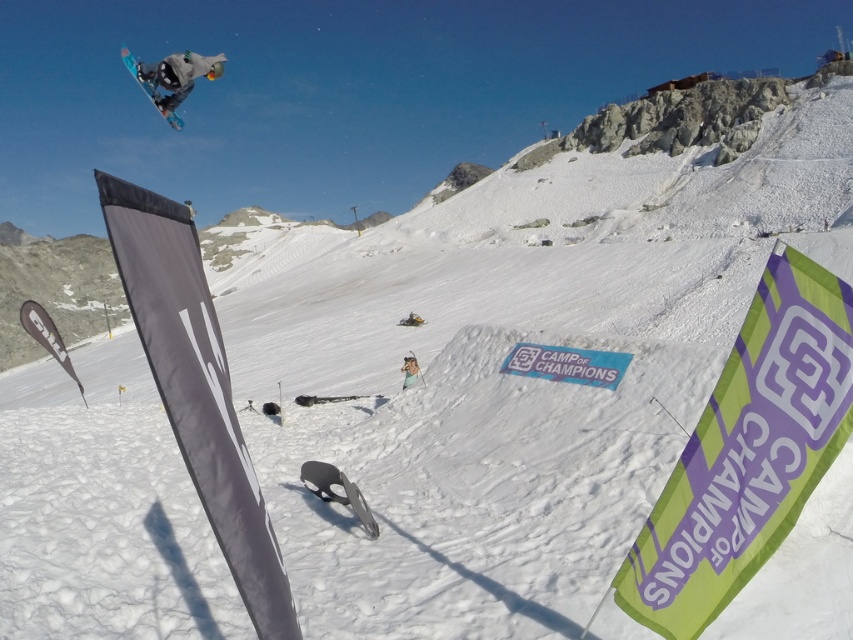
Question: Considering the real-world distances, which object is farthest from the gray matte snowboarder at upper left?

Choices:
 (A) white matte snowboarder at center
 (B) shiny blue snowboard at upper left

Answer: (B)

Question: Can you confirm if gray matte snowboarder at upper left is wider than white matte snowboarder at center?

Choices:
 (A) no
 (B) yes

Answer: (B)

Question: Is gray matte snowboarder at upper left above shiny blue snowboard at upper left?

Choices:
 (A) yes
 (B) no

Answer: (B)

Question: Which point is closer to the camera?

Choices:
 (A) shiny blue snowboard at upper left
 (B) gray matte snowboarder at upper left
 (C) white matte snowboarder at center

Answer: (C)

Question: Which object is farther from the camera taking this photo?

Choices:
 (A) shiny blue snowboard at upper left
 (B) white matte snowboarder at center
 (C) gray matte snowboarder at upper left

Answer: (A)

Question: Is gray matte snowboarder at upper left thinner than white matte snowboarder at center?

Choices:
 (A) yes
 (B) no

Answer: (B)